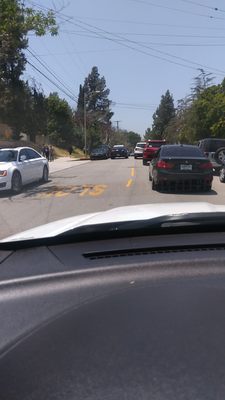
You are a GUI agent. You are given a task and a screenshot of the screen. Output one action in this format:
    pyautogui.click(x=<x>, y=<y>)
    Task: Click on the window
    The image size is (225, 400).
    Given the screenshot: What is the action you would take?
    pyautogui.click(x=167, y=198)